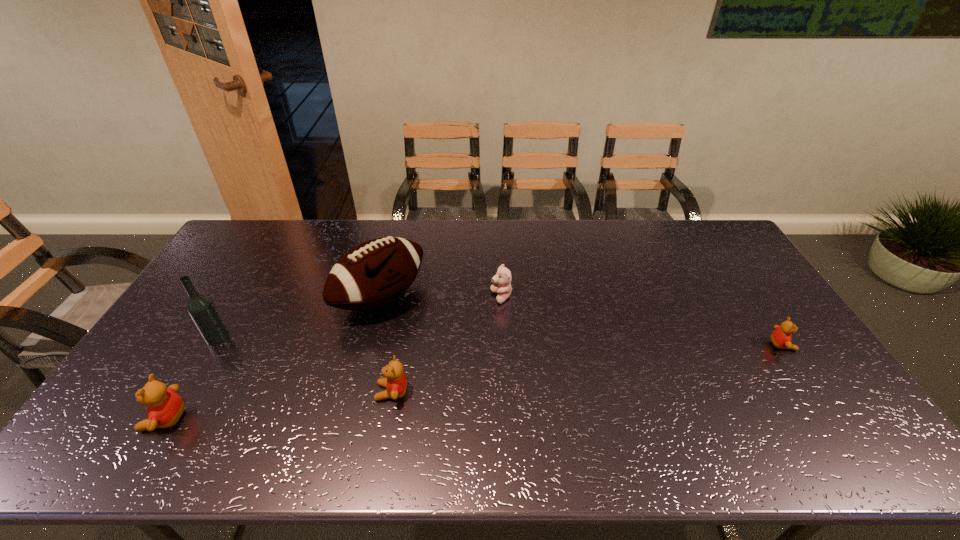
Please mark a free spot for a new teddy_bear to balance the arrangement. Please provide its 2D coordinates. Your answer should be formatted as a tuple, i.e. [(x, y)], where the tuple contains the x and y coordinates of a point satisfying the conditions above.

[(596, 367)]